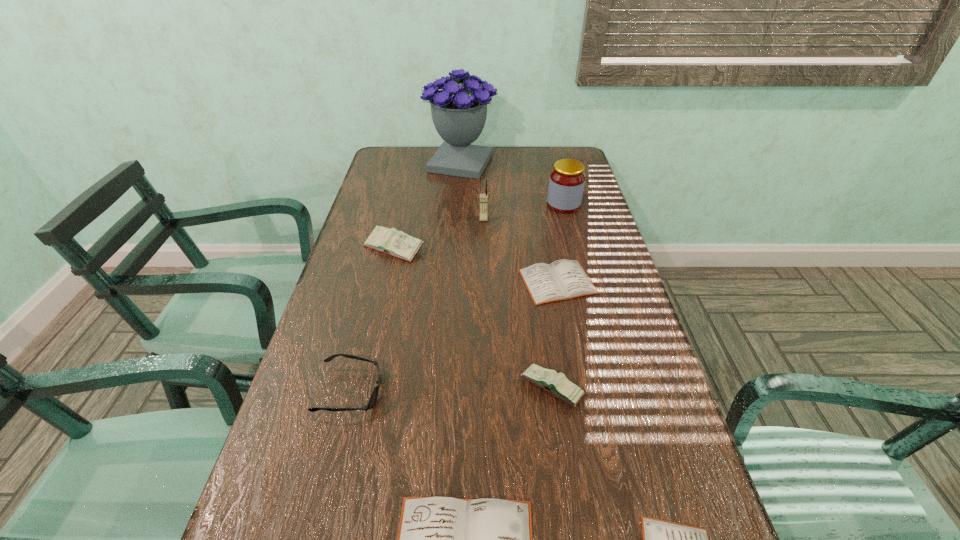
At what (x,y) coordinates should I click in order to perform the action: click on the farthest object. Please return your answer as a coordinate pair (x, y). This screenshot has width=960, height=540. Looking at the image, I should click on (459, 114).

Locate an element on the screen. the tallest object is located at coordinates (459, 114).

Locate an element on the screen. The width and height of the screenshot is (960, 540). the second farthest object is located at coordinates (567, 179).

You are a GUI agent. You are given a task and a screenshot of the screen. Output one action in this format:
    pyautogui.click(x=<x>, y=<y>)
    Task: Click on the jar
    
    Given the screenshot: What is the action you would take?
    pyautogui.click(x=567, y=179)

Locate an element on the screen. the seventh nearest object is located at coordinates point(483,197).

This screenshot has width=960, height=540. Identify the location of the tallest diary. (398, 244).

Locate an element on the screen. the leftmost diary is located at coordinates (398, 244).

Where is `sunglasses`? The height and width of the screenshot is (540, 960). sunglasses is located at coordinates [374, 395].

At what (x,y) coordinates should I click in order to perform the action: click on the third nearest diary. Please return your answer as a coordinate pair (x, y). Looking at the image, I should click on (557, 384).

At what (x,y) coordinates should I click in order to perform the action: click on the second tallest diary. Please return your answer as a coordinate pair (x, y). The height and width of the screenshot is (540, 960). Looking at the image, I should click on (557, 384).